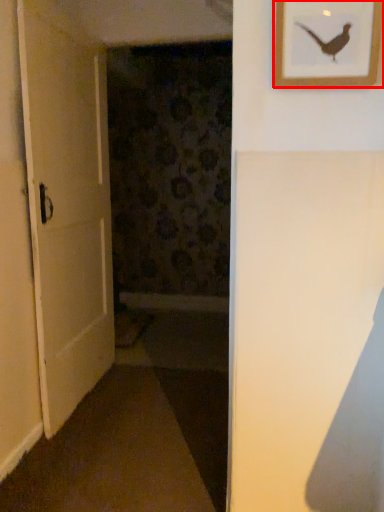
Question: From the image's perspective, where is picture frame (annotated by the red box) located in relation to door in the image?

Choices:
 (A) below
 (B) above

Answer: (B)